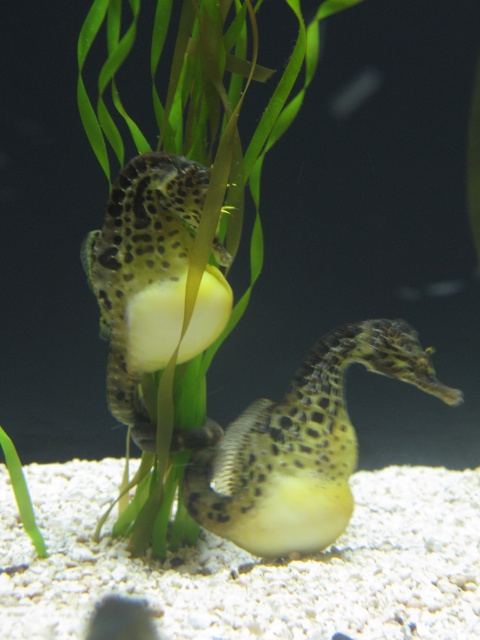
Which is behind, point (166, 522) or point (288, 412)?

The point (288, 412) is more distant.

Where is `green leafy plant at center`? The height and width of the screenshot is (640, 480). green leafy plant at center is located at coordinates (184, 244).

Where is `green leafy plant at center`? green leafy plant at center is located at coordinates (184, 244).